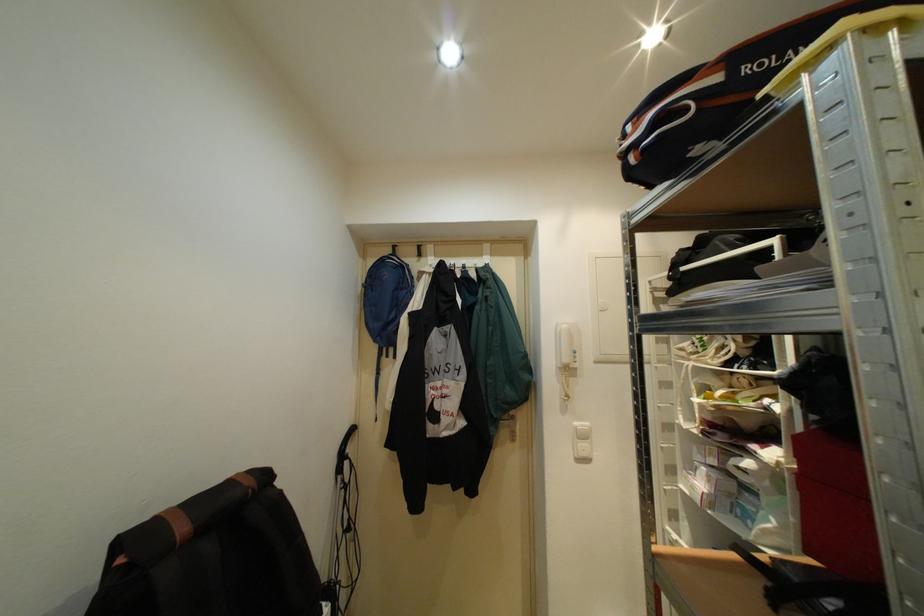
This screenshot has height=616, width=924. Identify the location of silver door handle. (509, 424).